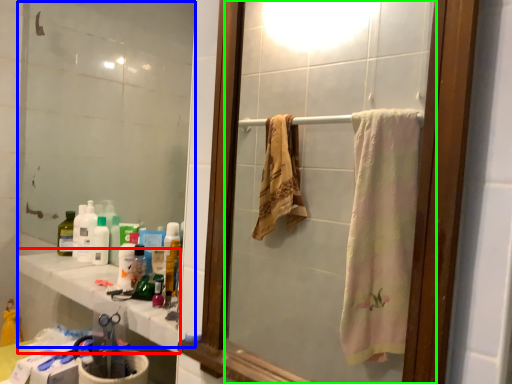
Question: Which is farther away from counter top (highlighted by a red box)? mirror (highlighted by a blue box) or mirror (highlighted by a green box)?

Choices:
 (A) mirror
 (B) mirror

Answer: (B)